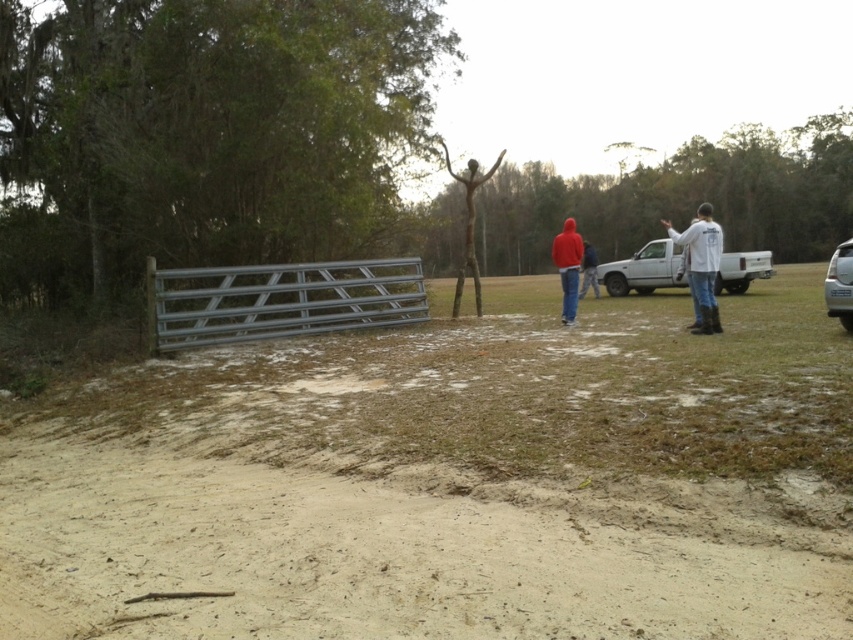
Question: Does silver metallic gate at center have a greater width compared to white matte truck at right?

Choices:
 (A) yes
 (B) no

Answer: (B)

Question: Is red matte hoodie at center wider than metallic silver car at right?

Choices:
 (A) no
 (B) yes

Answer: (B)

Question: Which of the following is the farthest from the observer?

Choices:
 (A) matte white hoodie at center
 (B) dull brown dirt at center
 (C) red matte hoodie at center
 (D) white matte shirt at right

Answer: (C)

Question: Which of the following is the farthest from the observer?

Choices:
 (A) (697, 300)
 (B) (701, 307)
 (C) (833, 307)

Answer: (A)

Question: Does white matte shirt at right have a greater width compared to red matte hoodie at center?

Choices:
 (A) no
 (B) yes

Answer: (B)

Question: Which of these objects is positioned closest to the white matte truck at right?

Choices:
 (A) matte white hoodie at center
 (B) metallic silver car at right

Answer: (B)